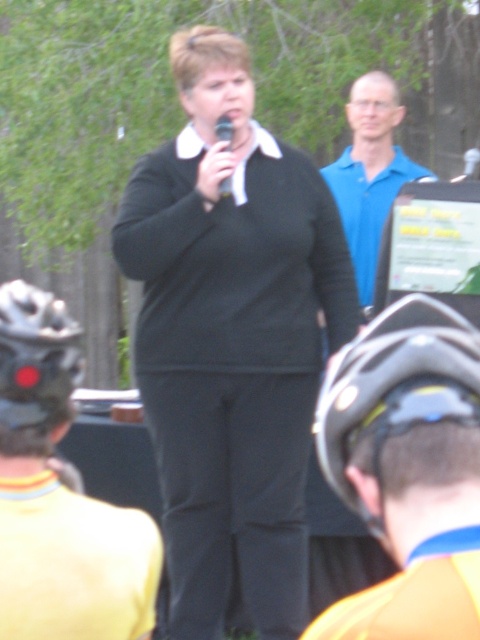
Does black matte sweater at center have a lesser width compared to black matte bicycle helmet at lower right?

In fact, black matte sweater at center might be wider than black matte bicycle helmet at lower right.

Where is `black matte sweater at center`? black matte sweater at center is located at coordinates (231, 339).

Is point (211, 528) positioned behind point (357, 400)?

Yes, point (211, 528) is farther from viewer.

Locate an element on the screen. The width and height of the screenshot is (480, 640). black matte sweater at center is located at coordinates (231, 339).

Which of these two, blue smooth shirt at upper center or black matte microphone at center, stands taller?

Standing taller between the two is blue smooth shirt at upper center.

Can you confirm if blue smooth shirt at upper center is wider than black matte microphone at center?

Indeed, blue smooth shirt at upper center has a greater width compared to black matte microphone at center.

Is point (348, 188) behind point (231, 138)?

Yes, it is behind point (231, 138).

The image size is (480, 640). What are the coordinates of `blue smooth shirt at upper center` in the screenshot? It's located at [370, 172].

In the scene shown: Who is positioned more to the left, black matte bicycle helmet at lower right or black matte microphone at center?

black matte microphone at center

What do you see at coordinates (395, 388) in the screenshot?
I see `black matte bicycle helmet at lower right` at bounding box center [395, 388].

Image resolution: width=480 pixels, height=640 pixels. What do you see at coordinates (395, 388) in the screenshot?
I see `black matte bicycle helmet at lower right` at bounding box center [395, 388].

Identify the location of black matte bicycle helmet at lower right. Image resolution: width=480 pixels, height=640 pixels. (395, 388).